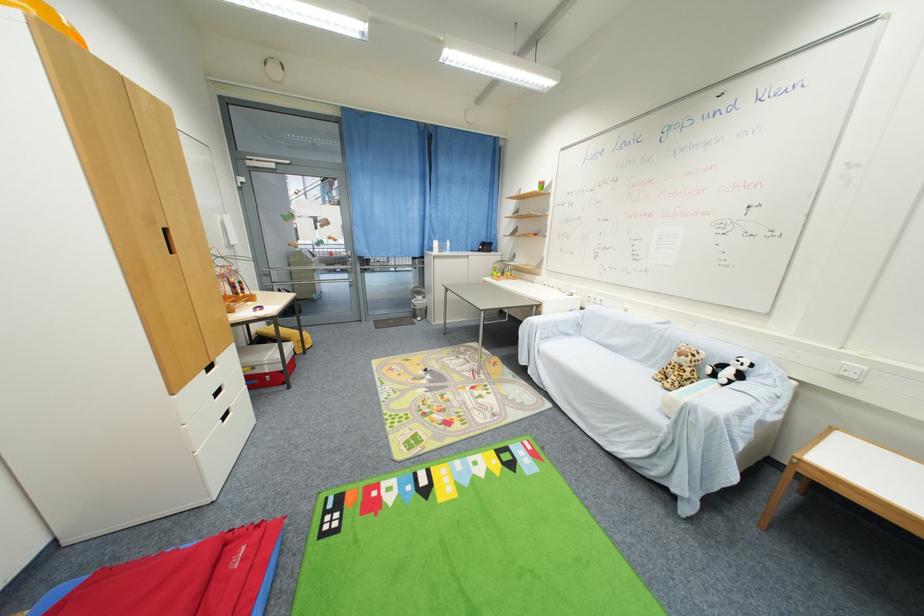
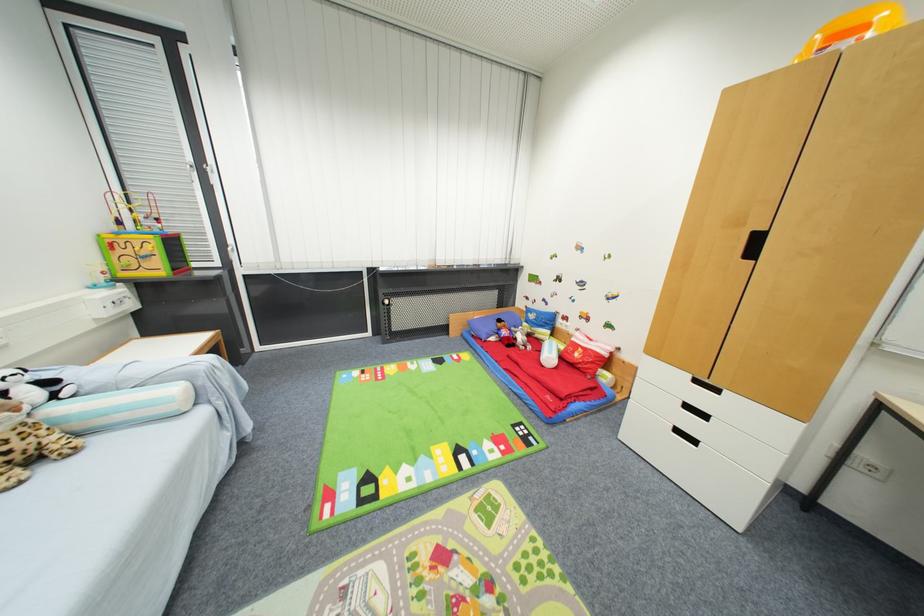
The point at (223, 395) is marked in the first image. Where is the corresponding point in the second image?

(691, 408)